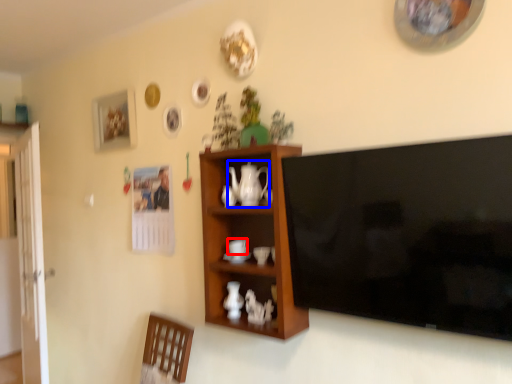
Question: Which object is further to the camera taking this photo, coffee cup (highlighted by a red box) or teapot (highlighted by a blue box)?

Choices:
 (A) coffee cup
 (B) teapot

Answer: (A)